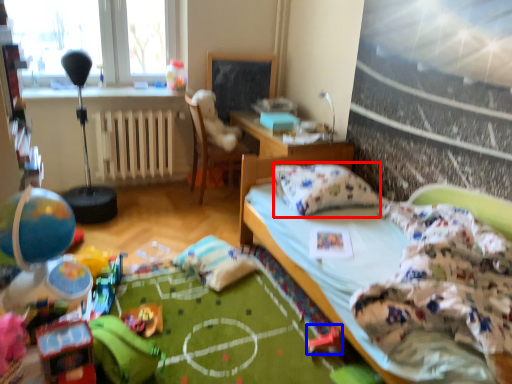
Question: Which object is further to the camera taking this photo, pillow (highlighted by a red box) or toy (highlighted by a blue box)?

Choices:
 (A) pillow
 (B) toy

Answer: (A)